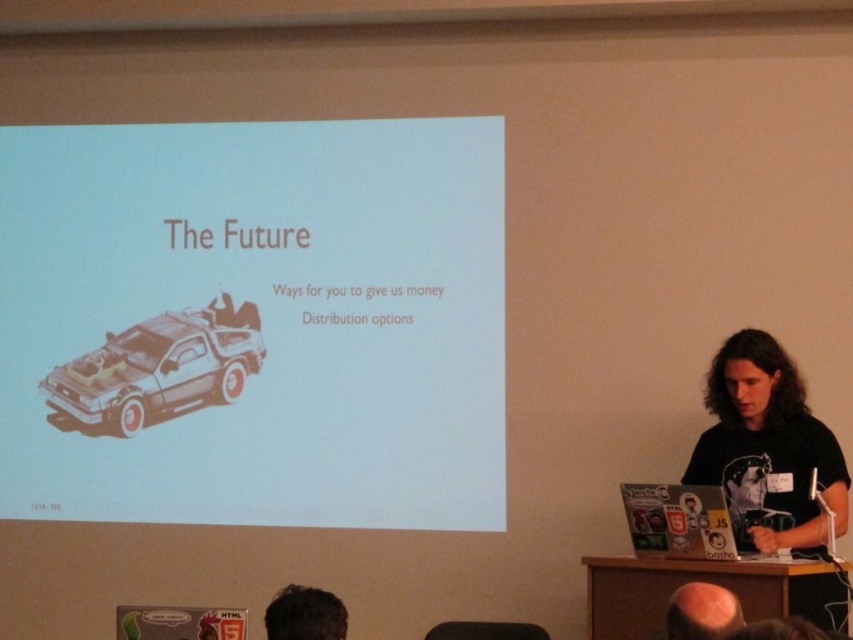
You are an attendee at the presentation. The presenter is pointing to the metallic silver car at center on the screen. If you want to draw attention to the car, where should you look on the screen?

The metallic silver car at center is located at point (158,369) on the screen, so you should look there to focus on it.

You are an attendee at this presentation and you want to take notes on the white paper at center. Where should you look to see the presenter and the dark brown hair at lower left while writing?

The white paper at center is positioned on the left side of dark brown hair at lower left, so you should look to your right to see the presenter and the dark brown hair at lower left while writing on the white paper at center.

You are an attendee at the presentation and want to take a photo of the metallic silver car at center and the smooth bald head at lower center. Which object should you focus on first to ensure both are in frame?

The metallic silver car at center is much taller than the smooth bald head at lower center, so you should focus on the metallic silver car at center first to ensure both are in frame.